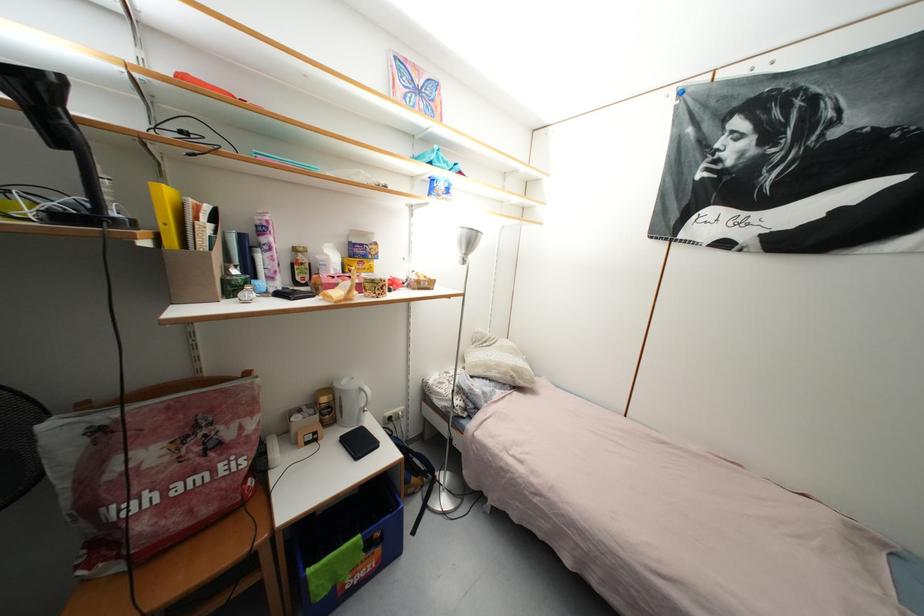
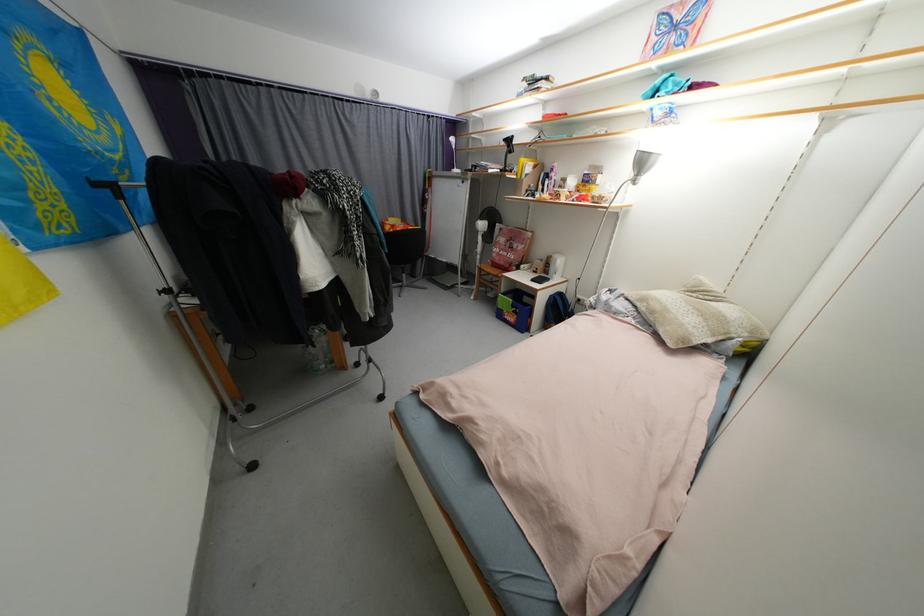
Find the pixel in the second image that matches (334,392) in the first image.

(557, 257)